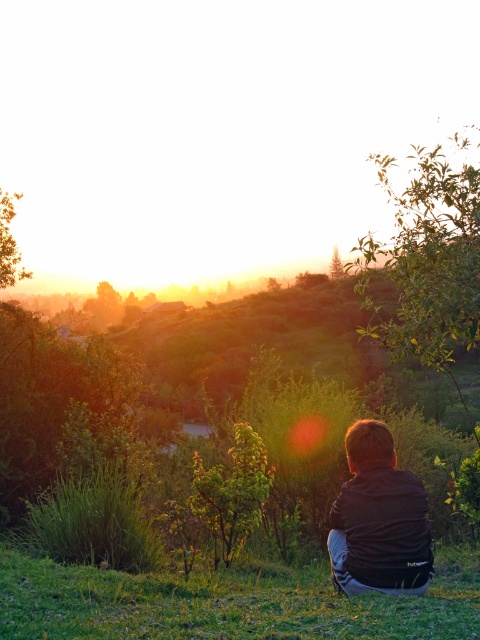
Question: Which object appears farthest from the camera in this image?

Choices:
 (A) black matte jacket at center
 (B) green grassy at lower center

Answer: (A)

Question: Where is green grassy at lower center located in relation to black matte jacket at center in the image?

Choices:
 (A) below
 (B) above

Answer: (A)

Question: Which point appears closest to the camera in this image?

Choices:
 (A) (358, 515)
 (B) (48, 628)

Answer: (B)

Question: Can you confirm if green grassy at lower center is wider than black matte jacket at center?

Choices:
 (A) yes
 (B) no

Answer: (A)

Question: Is green grassy at lower center to the left of black matte jacket at center from the viewer's perspective?

Choices:
 (A) no
 (B) yes

Answer: (B)